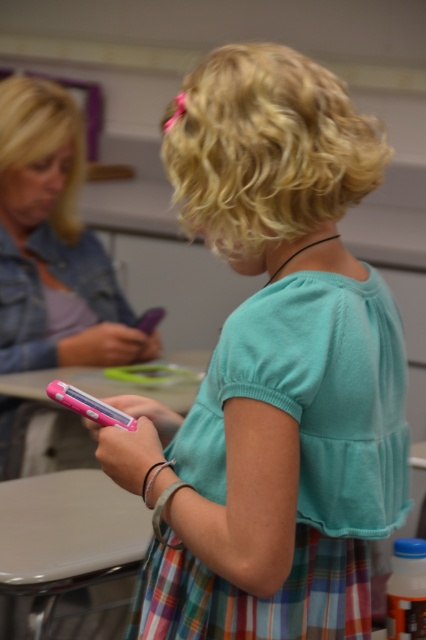
Based on the photo, you are standing in the classroom scene and want to determine which of the two points, point (155, 493) or point (80, 132), is nearer to you. Based on the image, which point is closer?

Point (155, 493) is closer to the camera than point (80, 132), so it is the nearer one.

You are a tailor measuring clothing items in a classroom. You have a matte teal shirt at center and a matte pink phone at left in front of you. Which item is wider?

The matte teal shirt at center is wider than the matte pink phone at left.

You are a tailor trying to determine if the matte teal shirt at center can be placed on a hanger that is designed to hold items no taller than the matte pink phone at left. Based on the scene, can the shirt fit on the hanger?

The matte teal shirt at center is shorter than the matte pink phone at left, so it can fit on the hanger designed to hold items no taller than the matte pink phone at left.